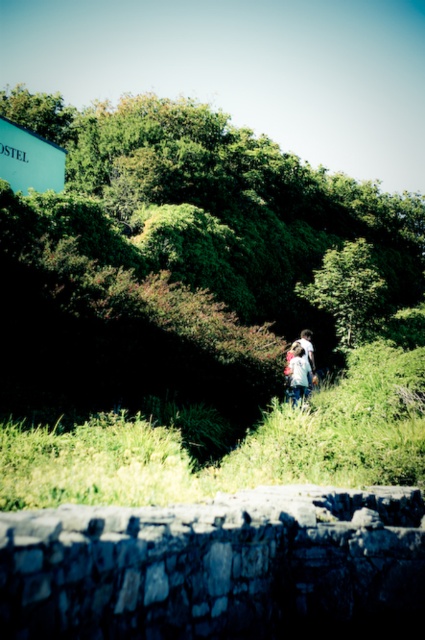
Does green painted signboard at upper left have a greater height compared to white matte jacket at center?

Indeed, green painted signboard at upper left has a greater height compared to white matte jacket at center.

Is point (51, 168) farther from camera compared to point (299, 342)?

That is True.

This screenshot has height=640, width=425. In order to click on green painted signboard at upper left in this screenshot , I will do `click(30, 160)`.

Is point (305, 360) positioned in front of point (309, 364)?

Yes, it is in front of point (309, 364).

In the scene shown: Is white matte jacket at center thinner than white cotton shirt at center?

Incorrect, white matte jacket at center's width is not less than white cotton shirt at center's.

Between point (289, 364) and point (294, 340), which one is positioned behind?

The point (294, 340) is more distant.

You are a GUI agent. You are given a task and a screenshot of the screen. Output one action in this format:
    pyautogui.click(x=<x>, y=<y>)
    Task: Click on the white matte jacket at center
    Image resolution: width=425 pixels, height=640 pixels.
    Given the screenshot: What is the action you would take?
    pyautogui.click(x=299, y=372)

Is green painted signboard at upper left wider than white cotton shirt at center?

Correct, the width of green painted signboard at upper left exceeds that of white cotton shirt at center.

Who is more forward, (39, 164) or (311, 362)?

Point (311, 362) is more forward.

Is point (42, 152) closer to viewer compared to point (306, 353)?

No.

This screenshot has height=640, width=425. I want to click on green painted signboard at upper left, so click(x=30, y=160).